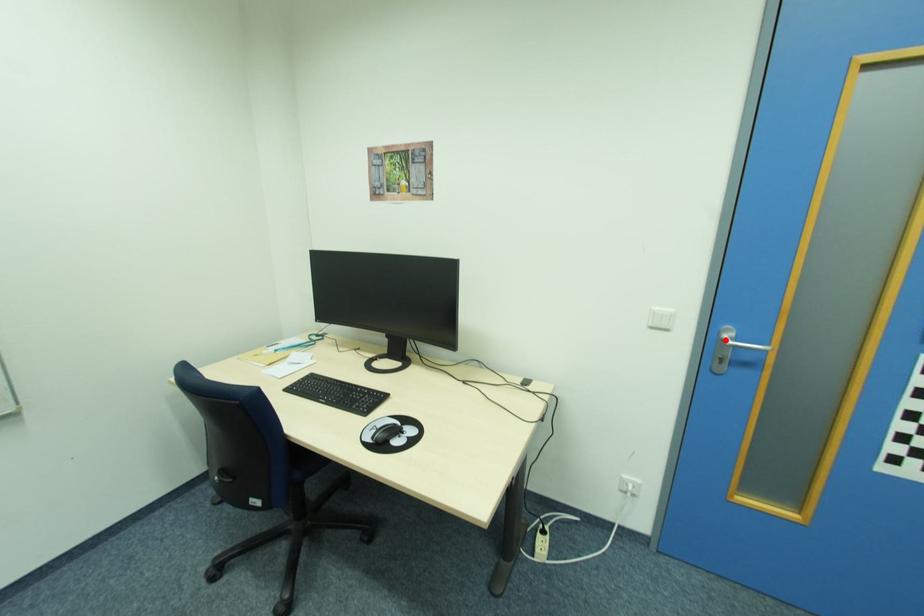
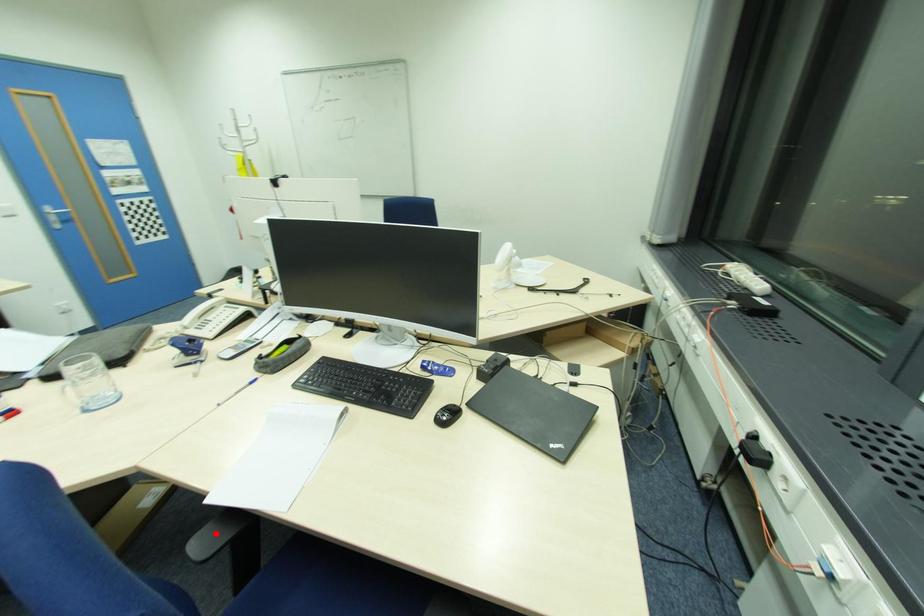
I am providing you with two images of the same scene from different viewpoints. A red point is marked on the first image and another point is marked on the second image. Are the points marked in image1 and image2 representing the same 3D position?

No